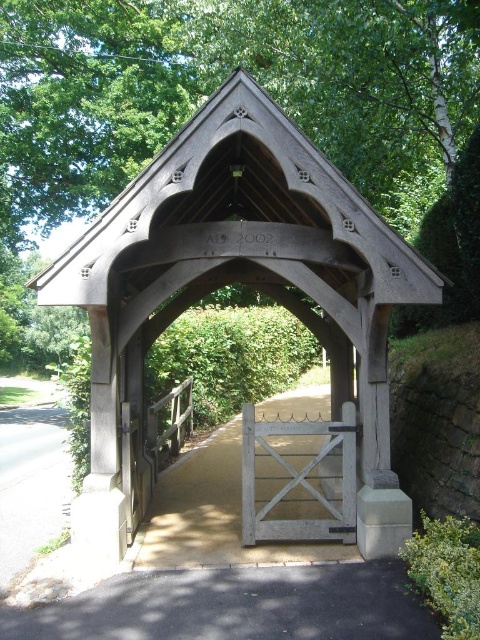
You are standing at the entrance of the lychgate and see a point marked at coordinates (237, 282). What object is located at this point?

The point at coordinates (237, 282) corresponds to the wooden gazebo at center.

You are standing in front of the lychgate and want to reach the point marked at coordinates point (128, 420). If your walking speed is 1.5 meters per second, how long will it take you to reach that point?

The point (128, 420) is 6.17 meters away from the camera. At a walking speed of 1.5 meters per second, it would take approximately 4.11 seconds to reach the point.

You are standing in front of the lychgate and want to enter through the white wooden gate at center. However, you notice the wooden gazebo at center is blocking your path. Can you still pass through the gate?

The wooden gazebo at center is located above the white wooden gate at center, so it does not block the path. You can still pass through the white wooden gate at center.